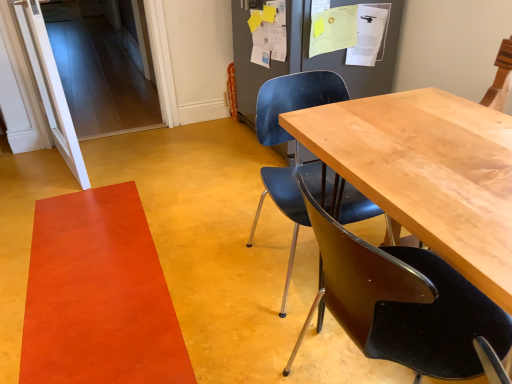
This screenshot has width=512, height=384. Identify the location of free space to the left of matte black chair at center, which is counted as the second chair, starting from the front. (203, 271).